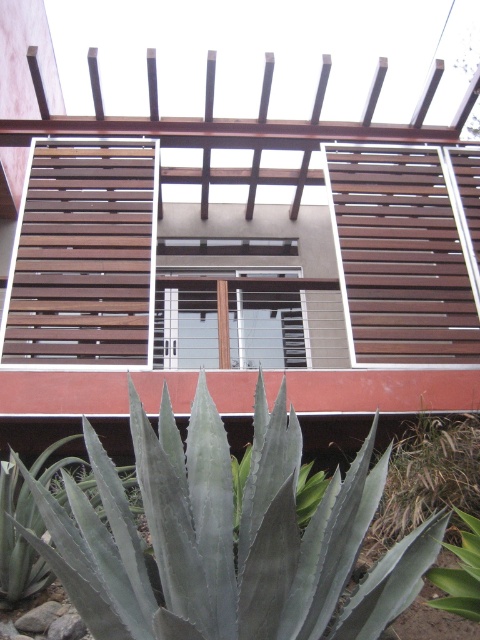
Can you confirm if green leafy plant at lower right is smaller than green succulent at lower center?

Incorrect, green leafy plant at lower right is not smaller in size than green succulent at lower center.

This screenshot has width=480, height=640. What do you see at coordinates (429, 474) in the screenshot?
I see `green leafy plant at lower right` at bounding box center [429, 474].

What are the coordinates of `green leafy plant at lower right` in the screenshot? It's located at (429, 474).

Is green leafy plant at lower right shorter than green leafy plant at lower left?

In fact, green leafy plant at lower right may be taller than green leafy plant at lower left.

Is green leafy plant at lower right positioned behind green leafy plant at lower left?

Yes.

Which is in front, point (450, 476) or point (82, 481)?

Point (450, 476)

You are a GUI agent. You are given a task and a screenshot of the screen. Output one action in this format:
    pyautogui.click(x=<x>, y=<y>)
    Task: Click on the green leafy plant at lower right
    The image size is (480, 640).
    Given the screenshot: What is the action you would take?
    pyautogui.click(x=429, y=474)

Who is positioned more to the left, green leafy plant at lower left or green succulent at lower center?

From the viewer's perspective, green leafy plant at lower left appears more on the left side.

Does green leafy plant at lower left have a greater width compared to green succulent at lower center?

Yes.

Who is more forward, (56, 464) or (463, 572)?

Point (463, 572) is more forward.

You are a GUI agent. You are given a task and a screenshot of the screen. Output one action in this format:
    pyautogui.click(x=<x>, y=<y>)
    Task: Click on the green leafy plant at lower left
    
    Given the screenshot: What is the action you would take?
    pyautogui.click(x=19, y=538)